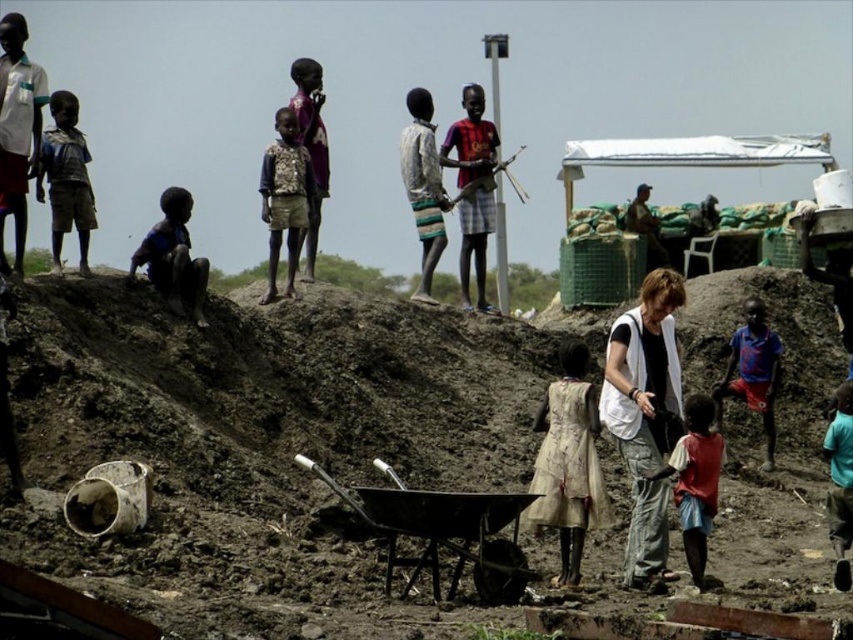
Question: Is light brown fabric shirt at upper left smaller than dark blue fabric at left?

Choices:
 (A) yes
 (B) no

Answer: (B)

Question: Based on their relative distances, which object is farther from the blue fabric shirt at lower right?

Choices:
 (A) striped fabric shirt at upper center
 (B) white cotton vest at center
 (C) striped fabric pants at upper center
 (D) light brown fabric shirt at upper left

Answer: (D)

Question: Does brown clay dirt at center appear on the right side of dark brown fabric shirt at upper left?

Choices:
 (A) yes
 (B) no

Answer: (A)

Question: Which point is closer to the camera?

Choices:
 (A) matte purple shirt at upper center
 (B) metallic wheelbarrow at center
 (C) light brown leather jacket at upper center
 (D) white cotton vest at center

Answer: (B)

Question: Which object is farther from the camera taking this photo?

Choices:
 (A) dark blue fabric at left
 (B) light brown leather jacket at upper center
 (C) dark brown fabric shirt at upper left
 (D) matte purple shirt at upper center

Answer: (B)

Question: Can you confirm if brown clay dirt at center is wider than white cotton vest at center?

Choices:
 (A) no
 (B) yes

Answer: (B)